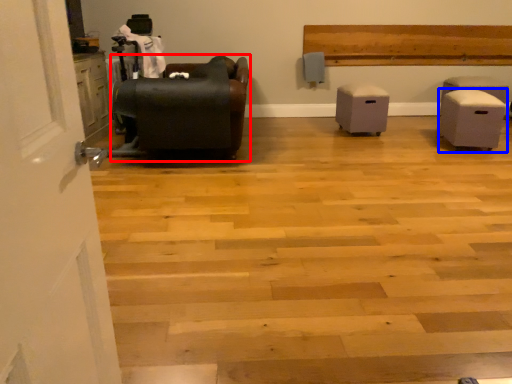
Question: Among these objects, which one is farthest to the camera, furniture (highlighted by a red box) or furniture (highlighted by a blue box)?

Choices:
 (A) furniture
 (B) furniture

Answer: (B)